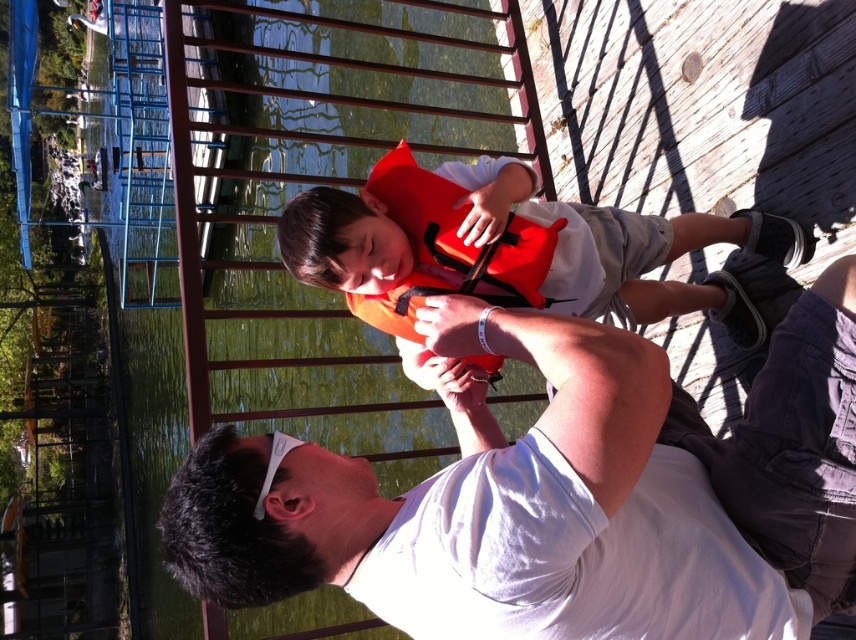
Based on the photo, you are a photographer trying to capture a clear image of both the white matte shirt at center and the orange matte life jacket at center. Since the camera can only focus on one object at a time, which object should you choose to ensure the larger one is in focus?

The white matte shirt at center is larger in size than the orange matte life jacket at center, so you should focus on the white matte shirt at center to ensure the larger object is in focus.

You are a lifeguard at the lake and need to choose between the orange life vest at center and the orange matte life jacket at center for a child. Which one is more suitable based on size?

The orange life vest at center is bigger than the orange matte life jacket at center, so the orange life vest at center is more suitable for the child as it provides better coverage and support.